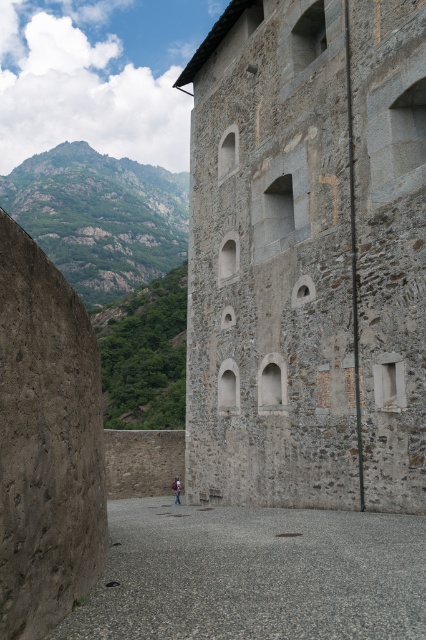
You are a soldier standing in the fortress courtyard. You need to deliver a message to the commander who is on the other side of the gray gravel alley at center. To reach him, you must first pass through the gray stone wall at center. Is this possible?

The gray stone wall at center is positioned over gray gravel alley at center, which means the wall is blocking the path to the alley. Therefore, you cannot pass through the gray stone wall at center to reach the commander on the other side of the gray gravel alley at center.

You are standing in the courtyard of the fortress and see the gray gravel alley at center and the light brown leather jacket at lower center. Which object is positioned to the right side of the other?

The gray gravel alley at center is to the right of light brown leather jacket at lower center, so the gray gravel alley at center is positioned to the right side of the light brown leather jacket at lower center.

You are standing in the courtyard of the fortress and notice a specific point marked at coordinates (307, 257). Based on the scene description, what object does this point most likely belong to?

The point at coordinates (307, 257) corresponds to the gray stone wall at center.